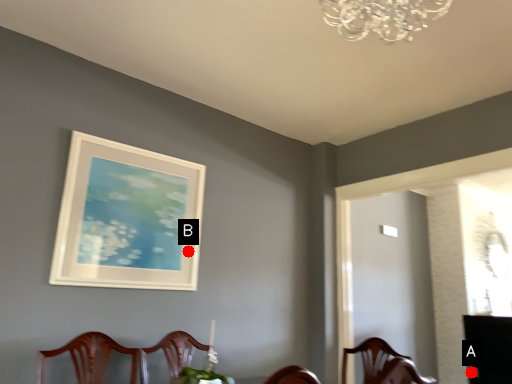
Question: Two points are circled on the image, labeled by A and B beside each circle. Which point is farther from the camera taking this photo?

Choices:
 (A) A is further
 (B) B is further

Answer: (A)